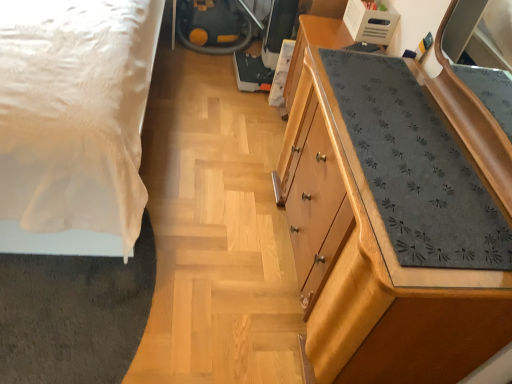
Question: Is white satin bed at left further to camera compared to wooden dresser at right?

Choices:
 (A) no
 (B) yes

Answer: (A)

Question: Does white satin bed at left have a larger size compared to wooden dresser at right?

Choices:
 (A) no
 (B) yes

Answer: (B)

Question: Can you confirm if white satin bed at left is wider than wooden dresser at right?

Choices:
 (A) no
 (B) yes

Answer: (B)

Question: Is white satin bed at left completely or partially outside of wooden dresser at right?

Choices:
 (A) no
 (B) yes

Answer: (B)

Question: Is white satin bed at left smaller than wooden dresser at right?

Choices:
 (A) yes
 (B) no

Answer: (B)

Question: Considering the relative positions of white satin bed at left and wooden dresser at right in the image provided, is white satin bed at left to the left of wooden dresser at right from the viewer's perspective?

Choices:
 (A) yes
 (B) no

Answer: (A)

Question: From the image's perspective, is wooden dresser at right above white satin bed at left?

Choices:
 (A) no
 (B) yes

Answer: (A)

Question: Considering the relative positions of wooden dresser at right and white satin bed at left in the image provided, is wooden dresser at right to the left of white satin bed at left from the viewer's perspective?

Choices:
 (A) yes
 (B) no

Answer: (B)

Question: Does wooden dresser at right come in front of white satin bed at left?

Choices:
 (A) no
 (B) yes

Answer: (A)

Question: From the image's perspective, does wooden dresser at right appear lower than white satin bed at left?

Choices:
 (A) no
 (B) yes

Answer: (B)

Question: Can you confirm if wooden dresser at right is wider than white satin bed at left?

Choices:
 (A) yes
 (B) no

Answer: (B)

Question: From a real-world perspective, does wooden dresser at right stand above white satin bed at left?

Choices:
 (A) no
 (B) yes

Answer: (A)

Question: Considering their positions, is wooden dresser at right located in front of or behind white satin bed at left?

Choices:
 (A) behind
 (B) front

Answer: (A)